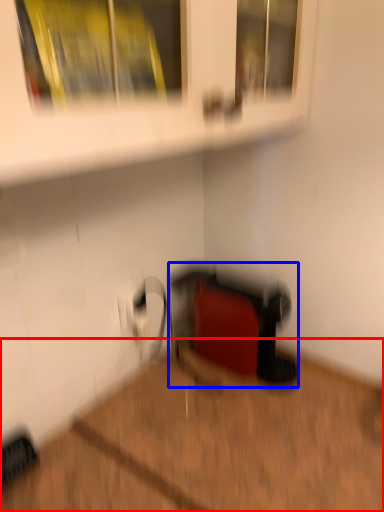
Question: Which object is closer to the camera taking this photo, hardwood (highlighted by a red box) or wide (highlighted by a blue box)?

Choices:
 (A) hardwood
 (B) wide

Answer: (A)